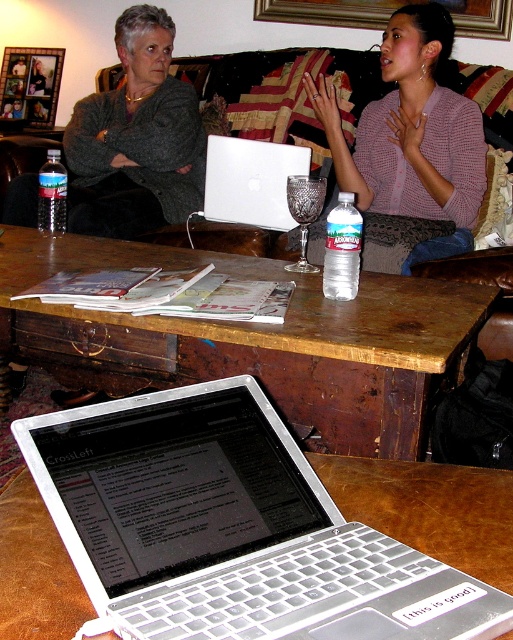
Question: Which point is farther from the camera taking this photo?

Choices:
 (A) (224, 145)
 (B) (384, 179)

Answer: (B)

Question: Which of the following is the farthest from the observer?

Choices:
 (A) brown wooden table at center
 (B) matte plastic water bottle at center
 (C) silver metallic laptop at center
 (D) velvet-like couch at center

Answer: (B)

Question: Which object appears closest to the camera in this image?

Choices:
 (A) matte plastic water bottle at center
 (B) white glossy laptop at center
 (C) velvet-like couch at center

Answer: (B)

Question: Can you confirm if velvet-like couch at center is positioned below white glossy laptop at center?

Choices:
 (A) yes
 (B) no

Answer: (B)

Question: Is silver metallic laptop at center smaller than white glossy laptop at center?

Choices:
 (A) yes
 (B) no

Answer: (A)

Question: Where is silver metallic laptop at center located in relation to matte plastic water bottle at center in the image?

Choices:
 (A) below
 (B) above

Answer: (A)